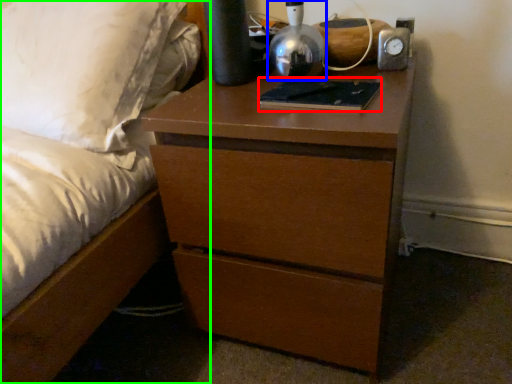
Question: Estimate the real-world distances between objects in this image. Which object is closer to book (highlighted by a red box), bedside lamp (highlighted by a blue box) or bed (highlighted by a green box)?

Choices:
 (A) bedside lamp
 (B) bed

Answer: (A)